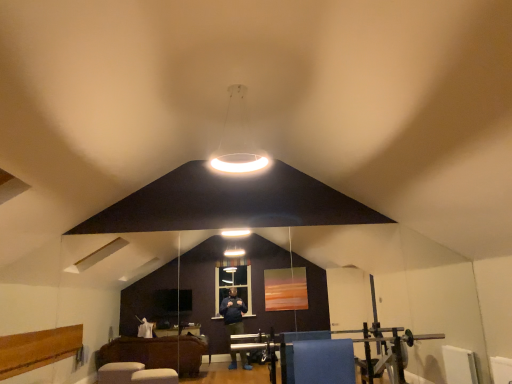
Question: Is blue fabric at lower center at the right side of white glossy ring light at center?

Choices:
 (A) yes
 (B) no

Answer: (A)

Question: Are blue fabric at lower center and white glossy ring light at center making contact?

Choices:
 (A) yes
 (B) no

Answer: (B)

Question: Does blue fabric at lower center have a greater width compared to white glossy ring light at center?

Choices:
 (A) no
 (B) yes

Answer: (A)

Question: Is blue fabric at lower center looking in the opposite direction of white glossy ring light at center?

Choices:
 (A) yes
 (B) no

Answer: (B)

Question: From a real-world perspective, does blue fabric at lower center sit lower than white glossy ring light at center?

Choices:
 (A) no
 (B) yes

Answer: (B)

Question: Does blue fabric at lower center have a larger size compared to white glossy ring light at center?

Choices:
 (A) yes
 (B) no

Answer: (B)

Question: Can we say white glossy ring light at center lies outside blue fabric at lower center?

Choices:
 (A) yes
 (B) no

Answer: (A)

Question: Is white glossy ring light at center at the left side of blue fabric at lower center?

Choices:
 (A) yes
 (B) no

Answer: (A)

Question: Does white glossy ring light at center have a larger size compared to blue fabric at lower center?

Choices:
 (A) yes
 (B) no

Answer: (A)

Question: Is white glossy ring light at center oriented towards blue fabric at lower center?

Choices:
 (A) yes
 (B) no

Answer: (B)

Question: Can you confirm if white glossy ring light at center is positioned to the right of blue fabric at lower center?

Choices:
 (A) no
 (B) yes

Answer: (A)

Question: Does white glossy ring light at center have a lesser height compared to blue fabric at lower center?

Choices:
 (A) yes
 (B) no

Answer: (B)

Question: Is white glossy ring light at center to the left or to the right of blue fabric at lower center in the image?

Choices:
 (A) right
 (B) left

Answer: (B)